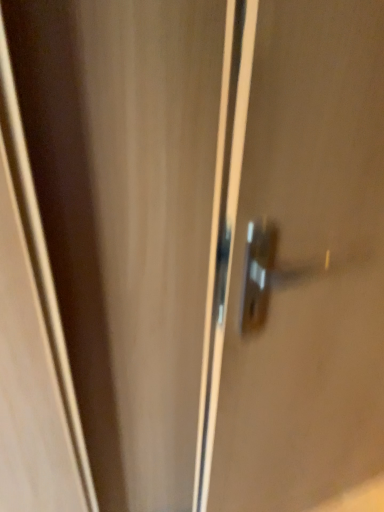
What do you see at coordinates (308, 265) in the screenshot? The width and height of the screenshot is (384, 512). I see `metallic silver handle at center` at bounding box center [308, 265].

The image size is (384, 512). In order to click on metallic silver handle at center in this screenshot , I will do `click(308, 265)`.

Image resolution: width=384 pixels, height=512 pixels. I want to click on metallic silver handle at center, so click(x=308, y=265).